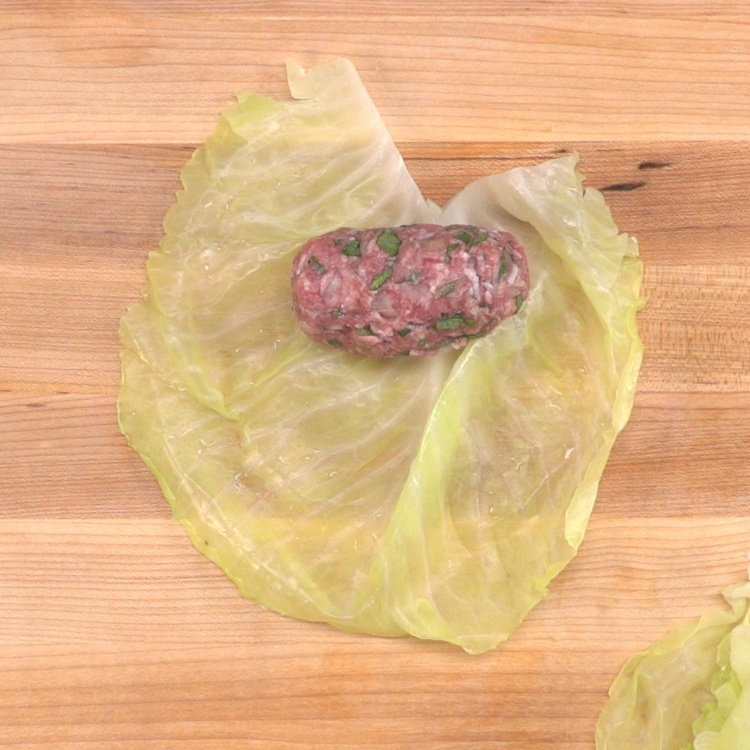
What are the coordinates of `knicks in wood board` in the screenshot? It's located at (628, 178), (646, 164).